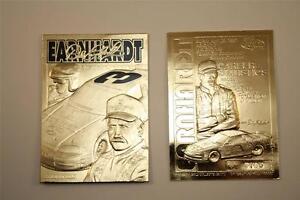
Locate an element on the screen. The height and width of the screenshot is (200, 300). side window is located at coordinates (132, 93), (231, 141).